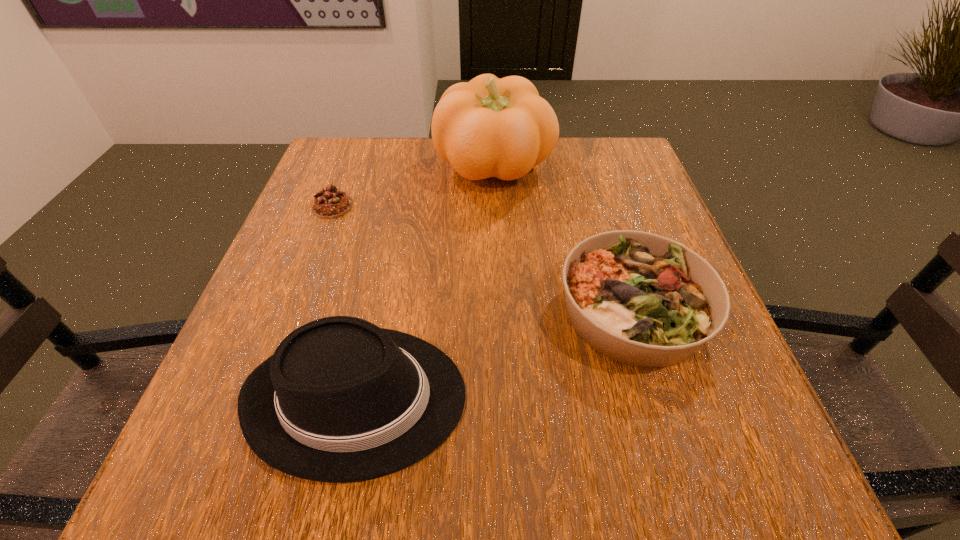
Where is `object that is the third closest one to the fedora`? object that is the third closest one to the fedora is located at coordinates (488, 127).

I want to click on object that is the closest to the fedora, so click(x=642, y=299).

This screenshot has width=960, height=540. Identify the location of free space that satisfies the following two spatial constraints: 1. on the front side of the tallest object; 2. on the front-facing side of the third shortest object. (504, 397).